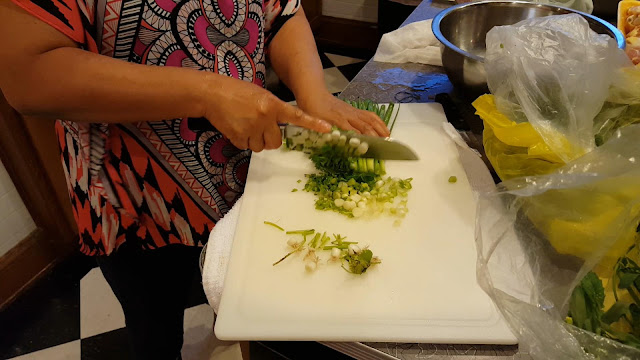
Image resolution: width=640 pixels, height=360 pixels. I want to click on wooden wall frame, so click(x=342, y=35), click(x=51, y=241).